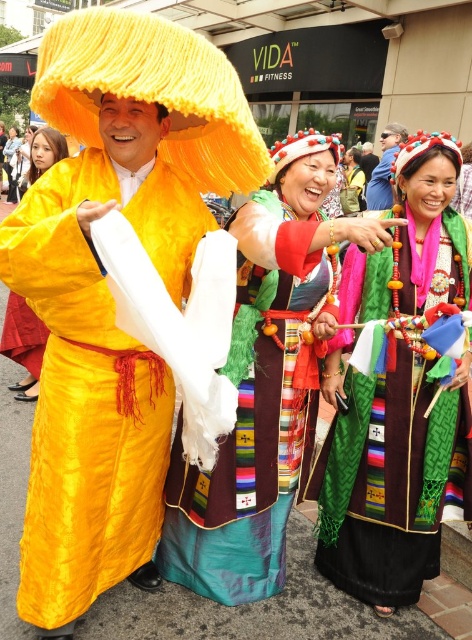
Who is lower down, silky green dress at center or matte yellow robe at center?

Positioned lower is silky green dress at center.

Is silky green dress at center to the left of matte yellow robe at center from the viewer's perspective?

In fact, silky green dress at center is to the right of matte yellow robe at center.

What do you see at coordinates (264, 384) in the screenshot? I see `silky green dress at center` at bounding box center [264, 384].

Find the location of a particular element. silky green dress at center is located at coordinates (264, 384).

Measure the distance from shiny silk robe at left to matte yellow robe at center.

The distance of shiny silk robe at left from matte yellow robe at center is 1.68 meters.

Is point (55, 556) closer to viewer compared to point (15, 314)?

That is True.

Which is in front, point (148, 465) or point (25, 321)?

Point (148, 465) is more forward.

Locate an element on the screen. shiny silk robe at left is located at coordinates (92, 385).

Is silky green dress at center further to camera compared to matte black sunglasses at upper center?

No.

Where is `silky green dress at center`? silky green dress at center is located at coordinates (264, 384).